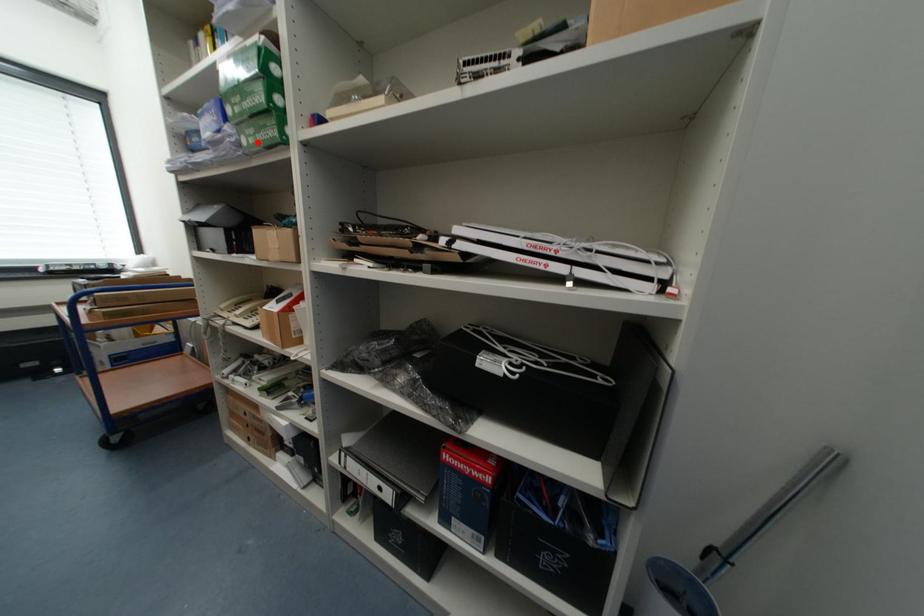
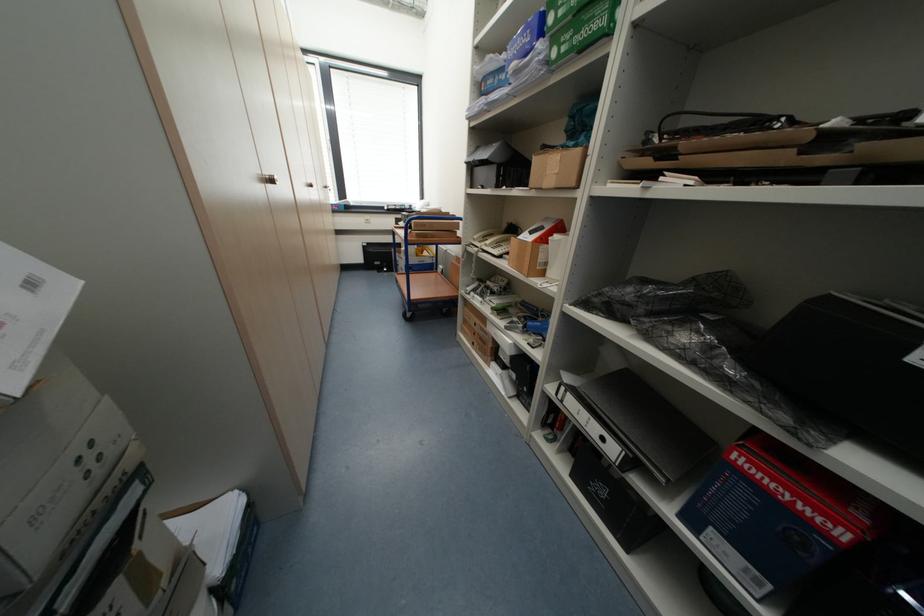
Locate, in the second image, the point that corresponds to the highlighted location in the first image.

(569, 50)